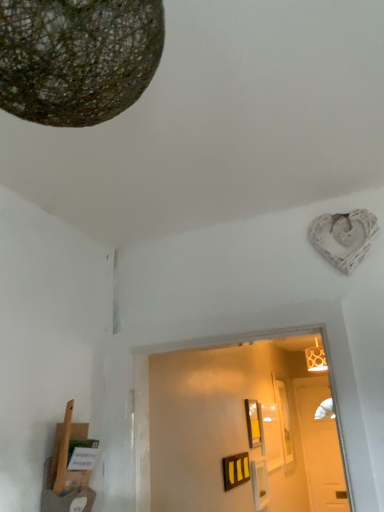
Question: Is matte yellow picture frame at center in contact with white wooden door at center?

Choices:
 (A) yes
 (B) no

Answer: (B)

Question: Is white wooden door at center a part of matte yellow picture frame at center?

Choices:
 (A) no
 (B) yes

Answer: (A)

Question: From the image's perspective, is matte yellow picture frame at center above white wooden door at center?

Choices:
 (A) yes
 (B) no

Answer: (A)

Question: Considering the relative sizes of matte yellow picture frame at center and white wooden door at center in the image provided, is matte yellow picture frame at center bigger than white wooden door at center?

Choices:
 (A) no
 (B) yes

Answer: (A)

Question: Is matte yellow picture frame at center thinner than white wooden door at center?

Choices:
 (A) no
 (B) yes

Answer: (B)

Question: In terms of width, does matte yellow picture frame at center look wider or thinner when compared to white wooden door at center?

Choices:
 (A) thin
 (B) wide

Answer: (A)

Question: From a real-world perspective, relative to white wooden door at center, is matte yellow picture frame at center vertically above or below?

Choices:
 (A) above
 (B) below

Answer: (A)

Question: Which is correct: matte yellow picture frame at center is inside white wooden door at center, or outside of it?

Choices:
 (A) inside
 (B) outside

Answer: (B)

Question: Is matte yellow picture frame at center in front of or behind white wooden door at center in the image?

Choices:
 (A) front
 (B) behind

Answer: (A)

Question: Which is correct: textured brown sphere at upper left is inside matte yellow picture frame at center, or outside of it?

Choices:
 (A) inside
 (B) outside

Answer: (B)

Question: Considering the positions of textured brown sphere at upper left and matte yellow picture frame at center in the image, is textured brown sphere at upper left wider or thinner than matte yellow picture frame at center?

Choices:
 (A) wide
 (B) thin

Answer: (A)

Question: Considering the relative positions of textured brown sphere at upper left and matte yellow picture frame at center in the image provided, is textured brown sphere at upper left to the left or to the right of matte yellow picture frame at center?

Choices:
 (A) right
 (B) left

Answer: (B)

Question: Considering their positions, is textured brown sphere at upper left located in front of or behind matte yellow picture frame at center?

Choices:
 (A) front
 (B) behind

Answer: (A)

Question: Visually, is white wooden door at center positioned to the left or to the right of textured brown sphere at upper left?

Choices:
 (A) right
 (B) left

Answer: (A)

Question: Is point (329, 503) closer or farther from the camera than point (57, 65)?

Choices:
 (A) farther
 (B) closer

Answer: (A)